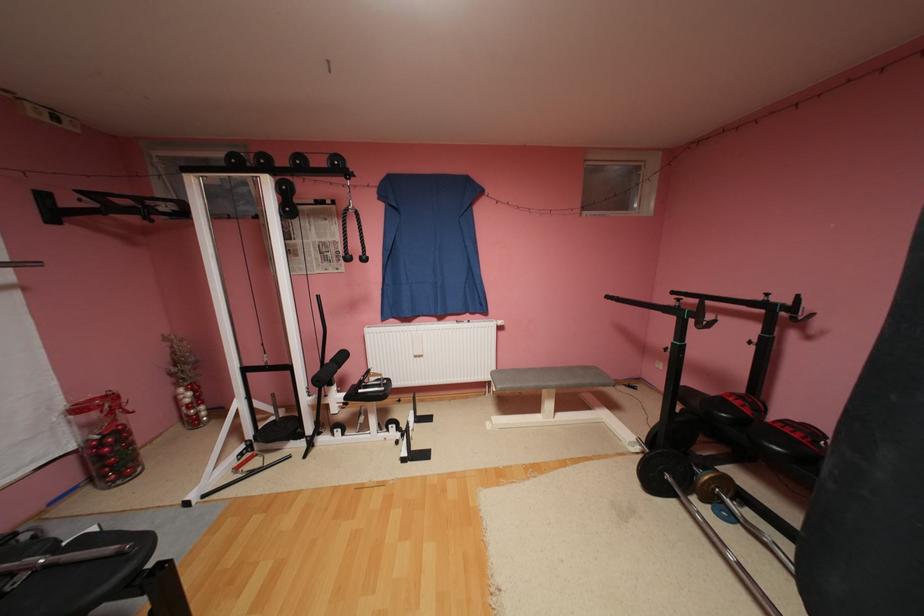
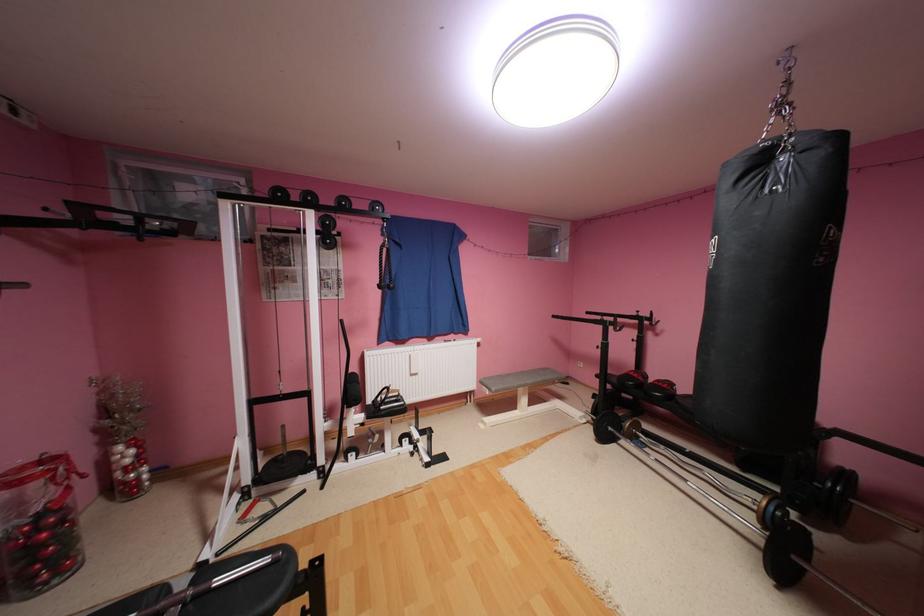
Where in the second image is the point corresponding to point (561, 383) from the first image?

(538, 382)